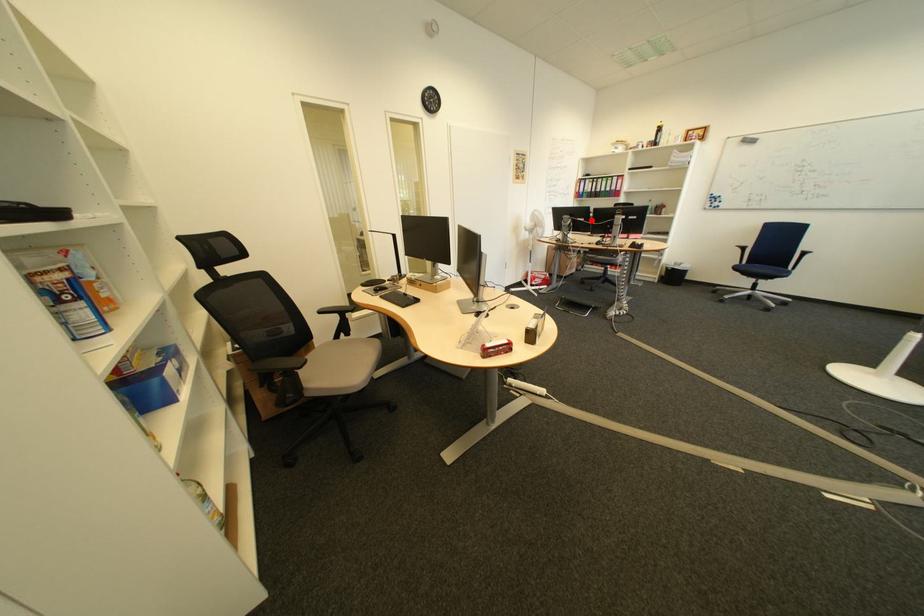
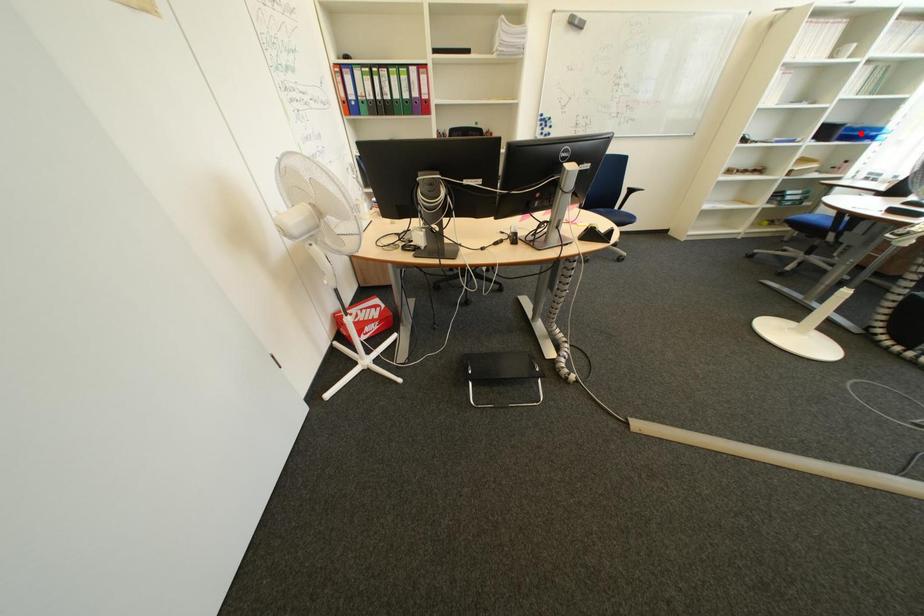
I am providing you with two images of the same scene from different viewpoints. A red point is marked on the first image and another point is marked on the second image. Are the points marked in image1 and image2 representing the same 3D position?

No